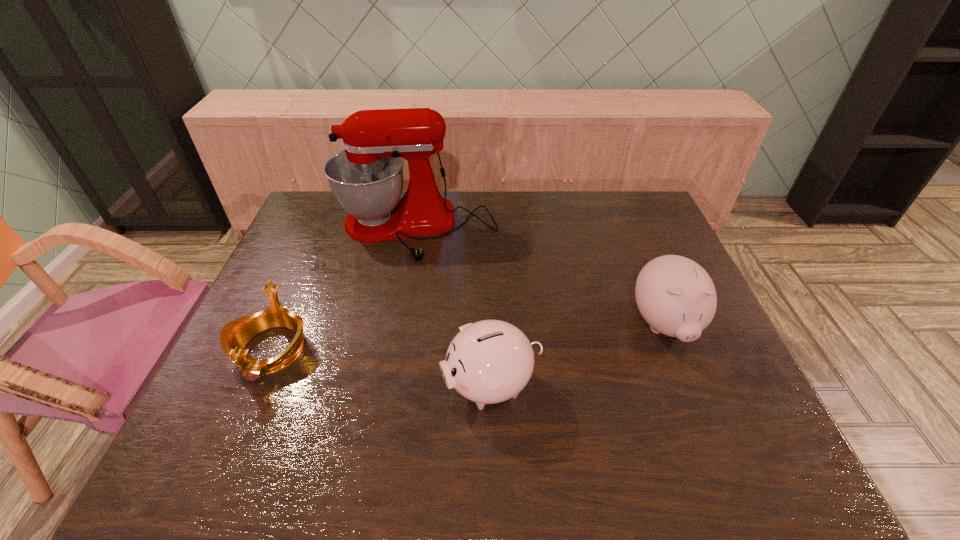
Image resolution: width=960 pixels, height=540 pixels. In order to click on free space between the rightmost object and the mixer in this screenshot , I will do `click(540, 278)`.

Where is `free point between the rightmost object and the mixer`? Image resolution: width=960 pixels, height=540 pixels. free point between the rightmost object and the mixer is located at coordinates tap(540, 278).

I want to click on free space between the tiara and the tallest object, so click(343, 290).

What are the coordinates of `unoccupied position between the right piggy bank and the mixer` in the screenshot? It's located at (540, 278).

This screenshot has height=540, width=960. In order to click on free spot between the shortest object and the left piggy bank in this screenshot , I will do `click(381, 368)`.

Identify the location of free space that is in between the tallest object and the right piggy bank. (540, 278).

You are a GUI agent. You are given a task and a screenshot of the screen. Output one action in this format:
    pyautogui.click(x=<x>, y=<y>)
    Task: Click on the blank region between the left piggy bank and the shortest object
    
    Given the screenshot: What is the action you would take?
    pyautogui.click(x=381, y=368)

This screenshot has height=540, width=960. Find the location of `object that stands as the second closest to the mixer`. object that stands as the second closest to the mixer is located at coordinates (490, 361).

Locate which object ranks third in proximity to the left piggy bank. Please provide its 2D coordinates. Your answer should be formatted as a tuple, i.e. [(x, y)], where the tuple contains the x and y coordinates of a point satisfying the conditions above.

[(234, 336)]

You are a GUI agent. You are given a task and a screenshot of the screen. Output one action in this format:
    pyautogui.click(x=<x>, y=<y>)
    Task: Click on the free space that satisfies the following two spatial constraints: 1. on the bowl side of the farthest object; 2. on the left side of the left piggy bank
    
    Given the screenshot: What is the action you would take?
    pyautogui.click(x=386, y=385)